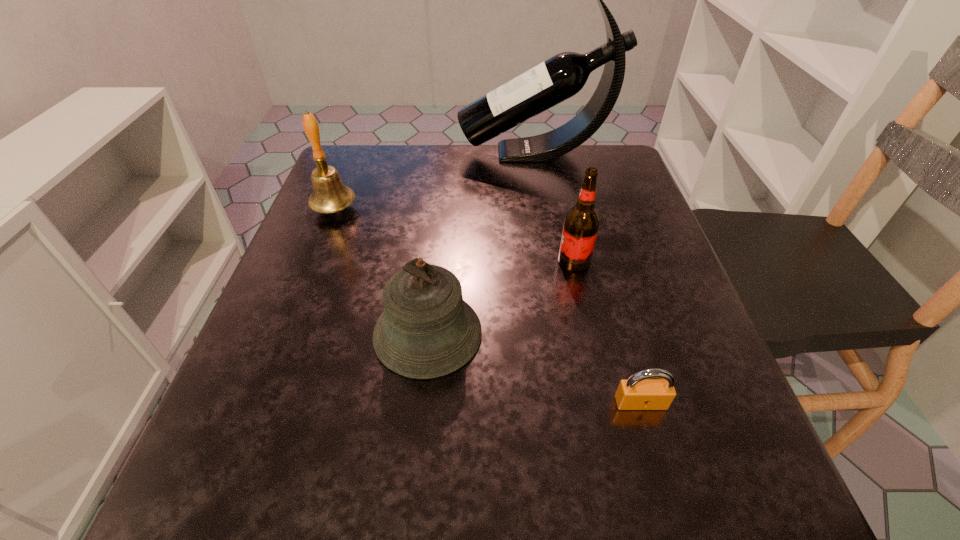
This screenshot has height=540, width=960. I want to click on vacant space at the near right corner of the desktop, so click(729, 514).

Find the location of `free spot between the second nearest object and the farthest object`. free spot between the second nearest object and the farthest object is located at coordinates (482, 243).

The height and width of the screenshot is (540, 960). In order to click on free space that is in between the farther bell and the tallest object in this screenshot , I will do `click(435, 181)`.

Locate an element on the screen. The height and width of the screenshot is (540, 960). vacant area between the tallest object and the root beer is located at coordinates (555, 207).

Identify the location of blank region between the wine bottle and the leftmost object. (435, 181).

Identify the location of vacant space that's between the padlock and the root beer. (608, 332).

Find the location of `free space between the root beer and the fourth tallest object`. free space between the root beer and the fourth tallest object is located at coordinates (501, 298).

Locate an element on the screen. The width and height of the screenshot is (960, 540). free space between the farther bell and the fourth farthest object is located at coordinates (381, 271).

Where is `vacant region between the right bell and the leftmost object`? The image size is (960, 540). vacant region between the right bell and the leftmost object is located at coordinates (381, 271).

Where is `empty space that is in between the wine bottle and the second nearest object`? empty space that is in between the wine bottle and the second nearest object is located at coordinates tap(482, 243).